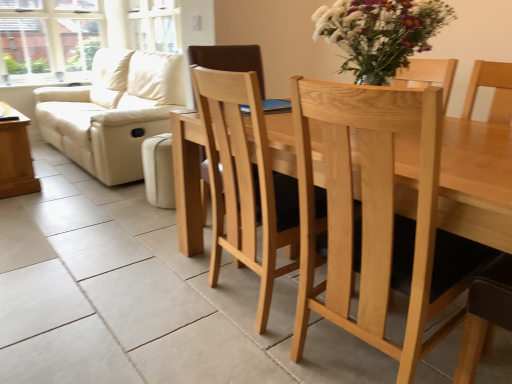
Find the location of a particular element. The image size is (512, 384). vacant space to the left of natural wood chair at center is located at coordinates (247, 341).